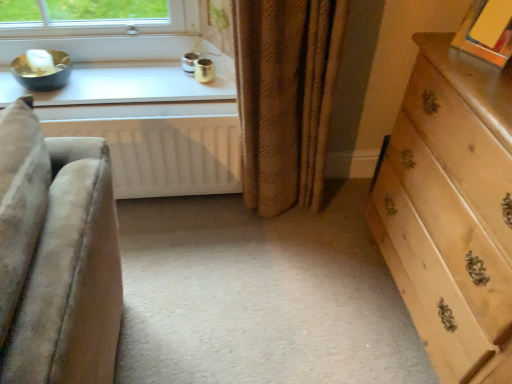
Locate an element on the screen. The image size is (512, 384). vacant space to the right of brown textured curtain at center is located at coordinates (x=343, y=212).